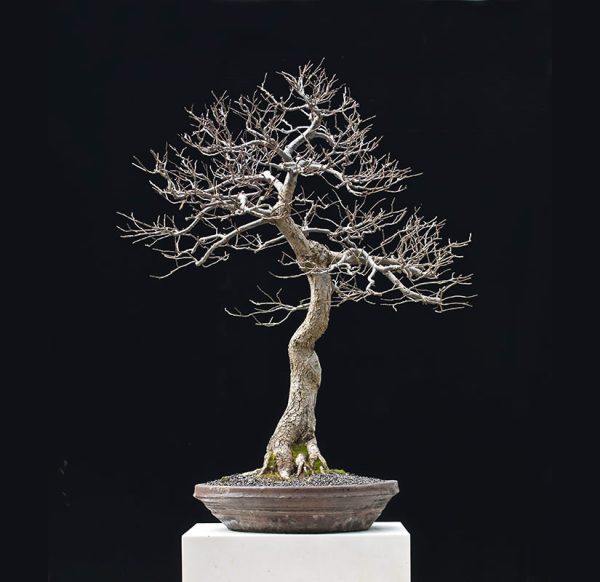
The height and width of the screenshot is (582, 600). In order to click on top of pedestal in this screenshot , I will do `click(398, 523)`.